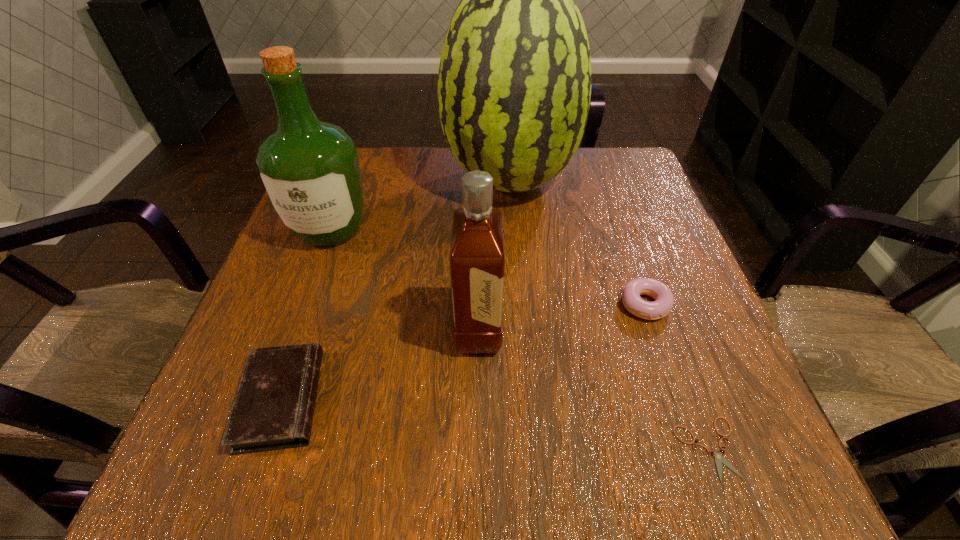
Identify the location of shears at the right edge. The width and height of the screenshot is (960, 540). (719, 459).

You are a GUI agent. You are given a task and a screenshot of the screen. Output one action in this format:
    pyautogui.click(x=<x>, y=<y>)
    Task: Click on the object present at the near left corner
    
    Given the screenshot: What is the action you would take?
    tap(274, 405)

Find the location of a particular element. The height and width of the screenshot is (540, 960). object positioned at the near right corner is located at coordinates (719, 459).

In order to click on vacant space at the far edge of the desktop in this screenshot , I will do `click(406, 164)`.

In the image, there is a desktop. Where is `blank space at the near edge`? This screenshot has width=960, height=540. blank space at the near edge is located at coordinates pyautogui.click(x=467, y=453).

Image resolution: width=960 pixels, height=540 pixels. In the image, there is a desktop. What are the coordinates of `vacant space at the right edge` in the screenshot? It's located at (656, 208).

Where is `empty space between the shears and the watermelon`? The image size is (960, 540). empty space between the shears and the watermelon is located at coordinates (609, 315).

The height and width of the screenshot is (540, 960). I want to click on vacant space in between the watermelon and the diary, so click(396, 291).

I want to click on vacant area that lies between the right liquor and the diary, so click(380, 365).

Locate an element on the screen. free spot between the farther liquor and the shortest object is located at coordinates (519, 340).